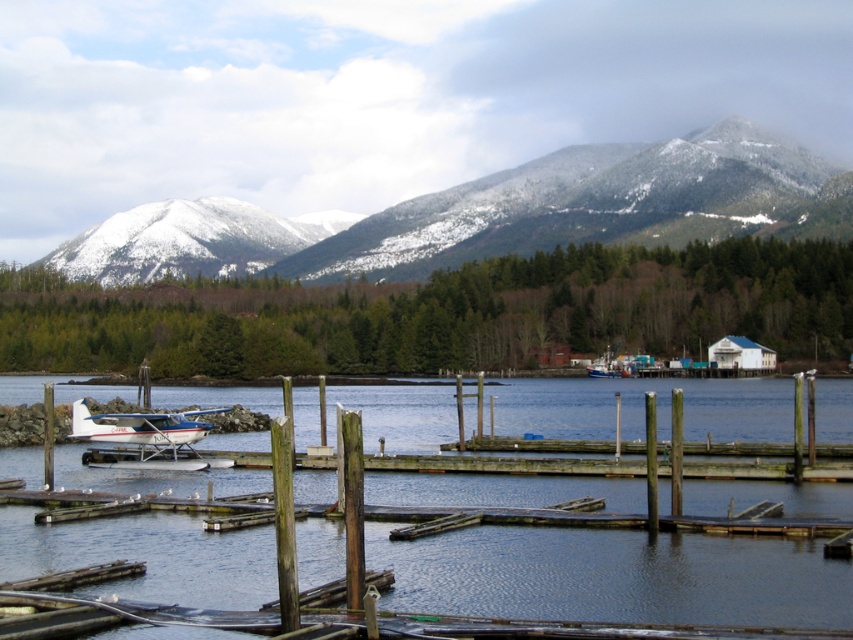
Question: Which object is positioned farthest from the white snow-covered mountain at upper center?

Choices:
 (A) white glossy seaplane at lower left
 (B) white snow-covered mountain at upper left

Answer: (A)

Question: Does white snow-covered mountain at upper center have a larger size compared to white glossy seaplane at lower left?

Choices:
 (A) no
 (B) yes

Answer: (B)

Question: Which object appears farthest from the camera in this image?

Choices:
 (A) white glossy seaplane at lower left
 (B) smooth blue water at center
 (C) white snow-covered mountain at upper left

Answer: (C)

Question: Does white snow-covered mountain at upper center appear on the right side of white snow-covered mountain at upper left?

Choices:
 (A) no
 (B) yes

Answer: (B)

Question: Can you confirm if smooth blue water at center is smaller than white glossy seaplane at lower left?

Choices:
 (A) yes
 (B) no

Answer: (B)

Question: Which point is closer to the camera?

Choices:
 (A) (741, 609)
 (B) (173, 451)
 (C) (80, 259)
 (D) (112, 268)

Answer: (A)